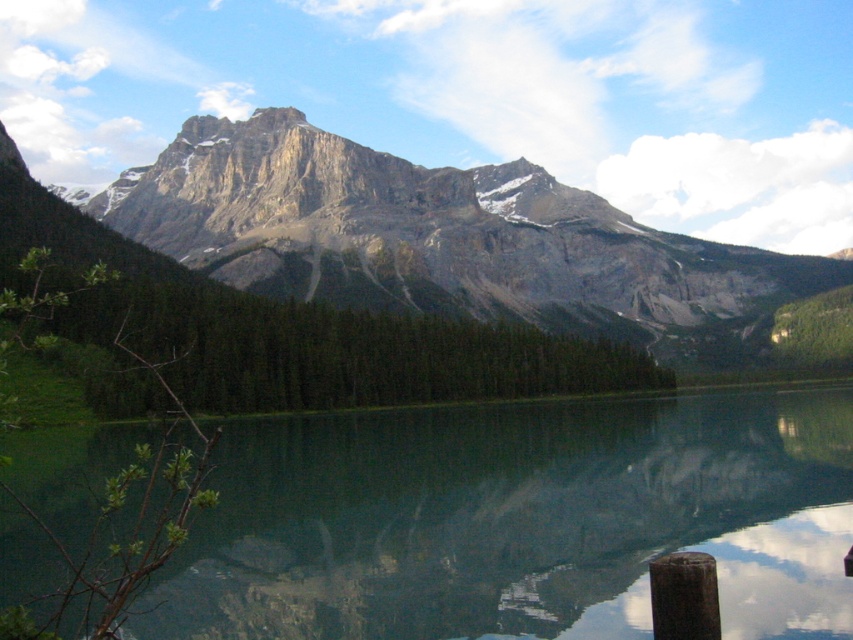
You are standing at the edge of the lake and want to throw a stone into the green glossy water at center. If you can throw the stone 120 meters, will it land in the water?

The distance between you and the green glossy water at center is 121.49 meters, so the stone will not reach the water as your throwing distance is shorter.

You are standing at the lakeside and want to take a photo of both the green glossy water at center and the rocky gray mountain range at upper center. Which object will appear larger in the photo?

The green glossy water at center will appear larger in the photo because it is closer to the viewer than the rocky gray mountain range at upper center.